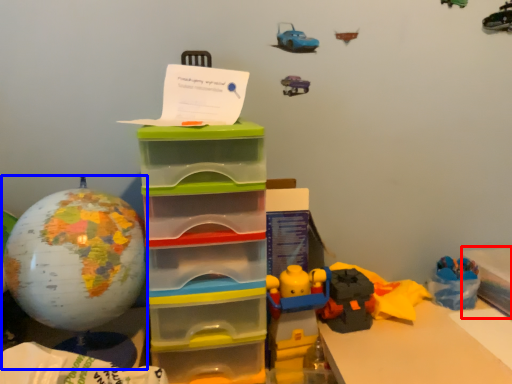
Question: Which object is closer to the camera taking this photo, storage box (highlighted by a red box) or toy (highlighted by a blue box)?

Choices:
 (A) storage box
 (B) toy

Answer: (B)